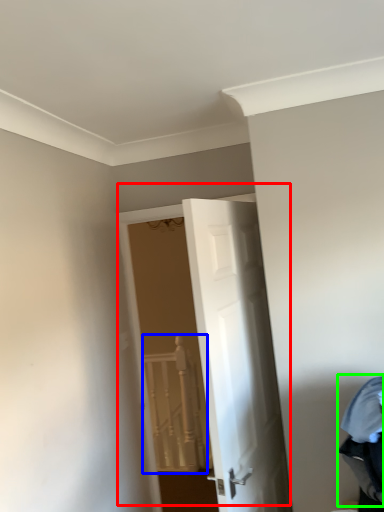
Question: Which is nearer to the door (highlighted by a red box)? rail (highlighted by a blue box) or laundry (highlighted by a green box).

Choices:
 (A) rail
 (B) laundry

Answer: (B)